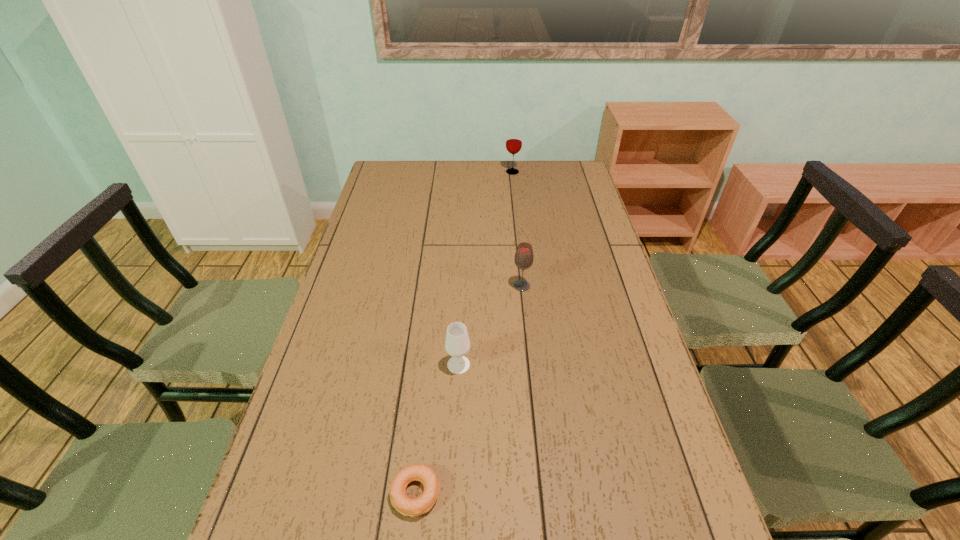
The image size is (960, 540). I want to click on the farthest glass, so coord(514,137).

Find the location of a particular element. the second farthest glass is located at coordinates (523, 259).

At what (x,y) coordinates should I click in order to perform the action: click on the nearest glass. Please return your answer as a coordinate pair (x, y). Looking at the image, I should click on (457, 344).

Identify the location of the second nearest object. (457, 344).

You are a GUI agent. You are given a task and a screenshot of the screen. Output one action in this format:
    pyautogui.click(x=<x>, y=<y>)
    Task: Click on the nearest object
    
    Given the screenshot: What is the action you would take?
    pyautogui.click(x=426, y=475)

I want to click on bagel, so click(x=426, y=475).

At what (x,y) coordinates should I click in order to perform the action: click on free spot located on the front of the farthest object. Please return your answer as a coordinate pair (x, y). The height and width of the screenshot is (540, 960). Looking at the image, I should click on (517, 213).

I want to click on free spot located on the front of the second farthest object, so click(x=526, y=331).

Locate an element on the screen. free point located 0.080m on the back of the second nearest object is located at coordinates (460, 333).

Locate an element on the screen. This screenshot has height=540, width=960. free space located on the back of the nearest object is located at coordinates (420, 439).